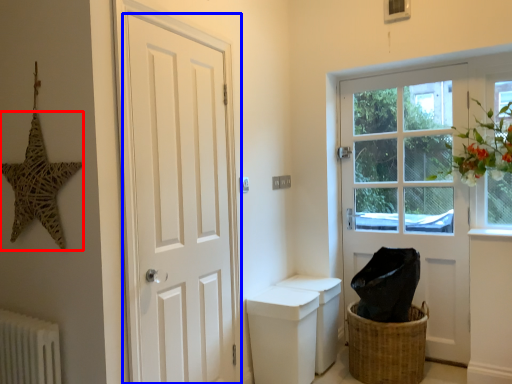
Question: Which point is further to the camera, star (highlighted by a red box) or door (highlighted by a blue box)?

Choices:
 (A) star
 (B) door

Answer: (B)